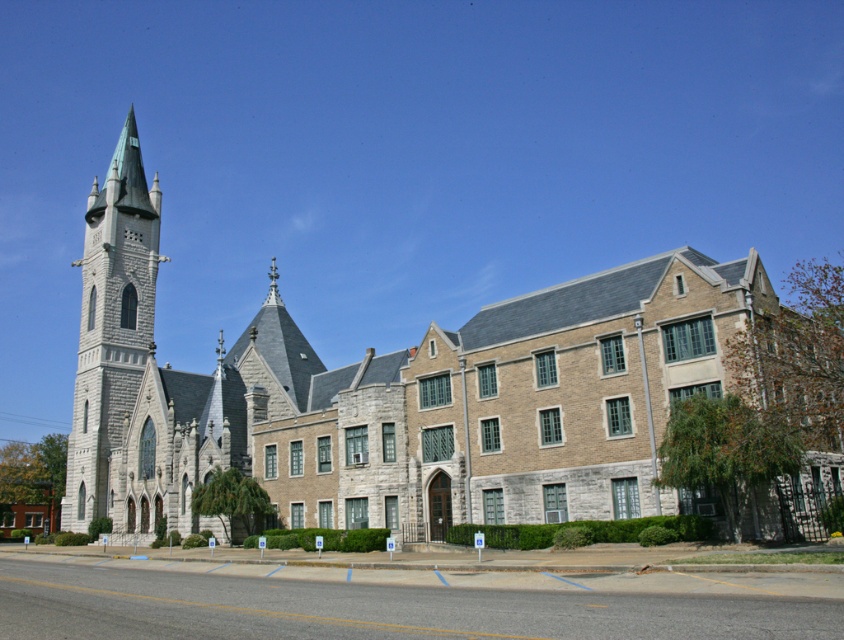
Question: Among these points, which one is nearest to the camera?

Choices:
 (A) (109, 504)
 (B) (109, 192)

Answer: (A)

Question: Can you confirm if gray stone church at left is smaller than gray stone tower at left?

Choices:
 (A) yes
 (B) no

Answer: (B)

Question: Does gray stone church at left come behind gray stone tower at left?

Choices:
 (A) no
 (B) yes

Answer: (A)

Question: Which object appears farthest from the camera in this image?

Choices:
 (A) gray stone tower at left
 (B) gray stone church at left

Answer: (A)

Question: Does gray stone church at left have a larger size compared to gray stone tower at left?

Choices:
 (A) yes
 (B) no

Answer: (A)

Question: Which of the following is the farthest from the observer?

Choices:
 (A) (477, 410)
 (B) (100, 513)

Answer: (B)